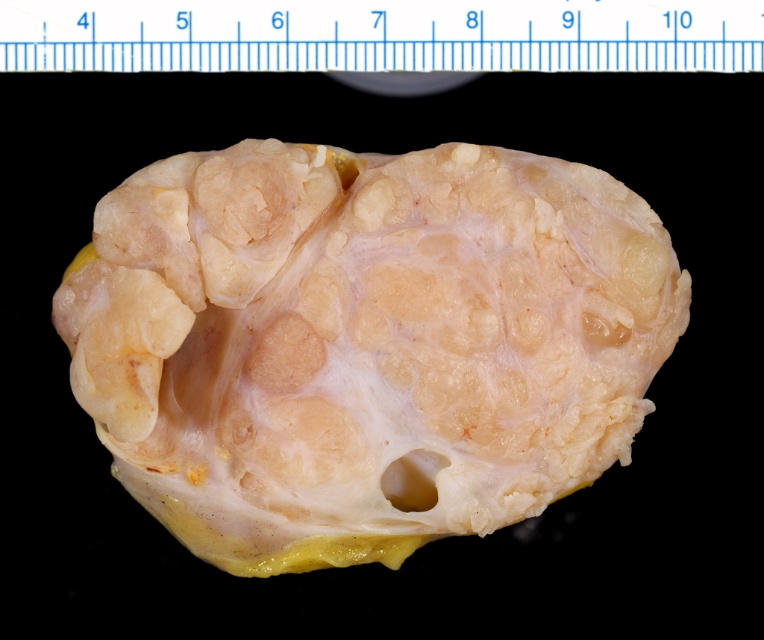
Who is more distant from viewer, (455, 268) or (180, 44)?

Point (180, 44)

Consider the image. Is translucent yellowish flesh at center smaller than white plastic ruler at upper center?

No.

Is point (419, 240) behind point (102, 44)?

No, it is in front of (102, 44).

The image size is (764, 640). In order to click on translucent yellowish flesh at center in this screenshot , I will do `click(364, 342)`.